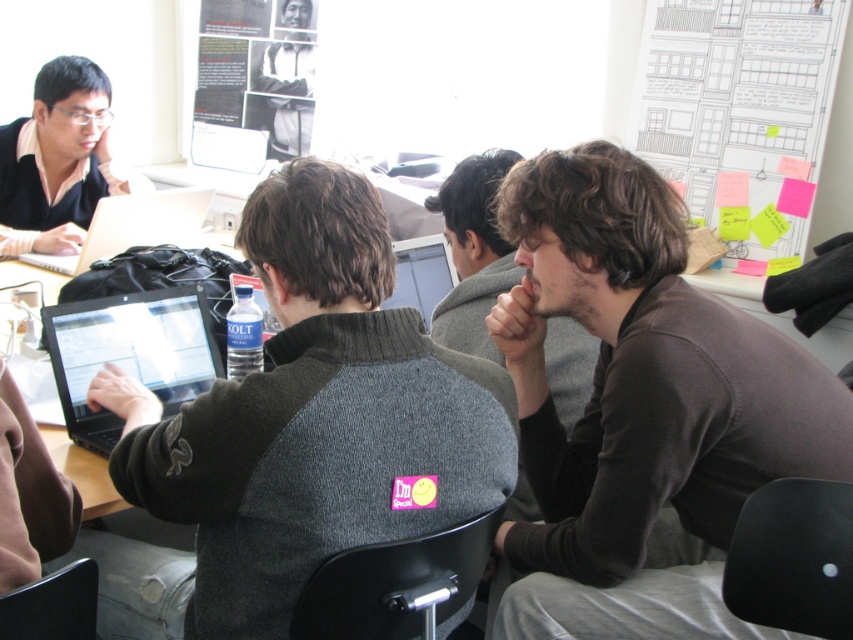
Question: Which object is farther from the camera taking this photo?

Choices:
 (A) matte black laptop at upper left
 (B) matte black laptop at center
 (C) dark gray sweater at center

Answer: (A)

Question: Among these points, which one is nearest to the camera?

Choices:
 (A) (100, 214)
 (B) (42, 316)
 (C) (451, 273)
 (D) (474, 301)

Answer: (B)

Question: Which object is positioned farthest from the matte black laptop at upper left?

Choices:
 (A) black glossy laptop at center
 (B) brown soft sweater at center

Answer: (B)

Question: Can you confirm if brown soft sweater at center is positioned above matte black laptop at upper left?

Choices:
 (A) no
 (B) yes

Answer: (A)

Question: Is silver metallic laptop at left bigger than matte black laptop at center?

Choices:
 (A) no
 (B) yes

Answer: (B)

Question: Considering the relative positions of brown soft sweater at center and matte black laptop at center in the image provided, where is brown soft sweater at center located with respect to matte black laptop at center?

Choices:
 (A) below
 (B) above

Answer: (A)